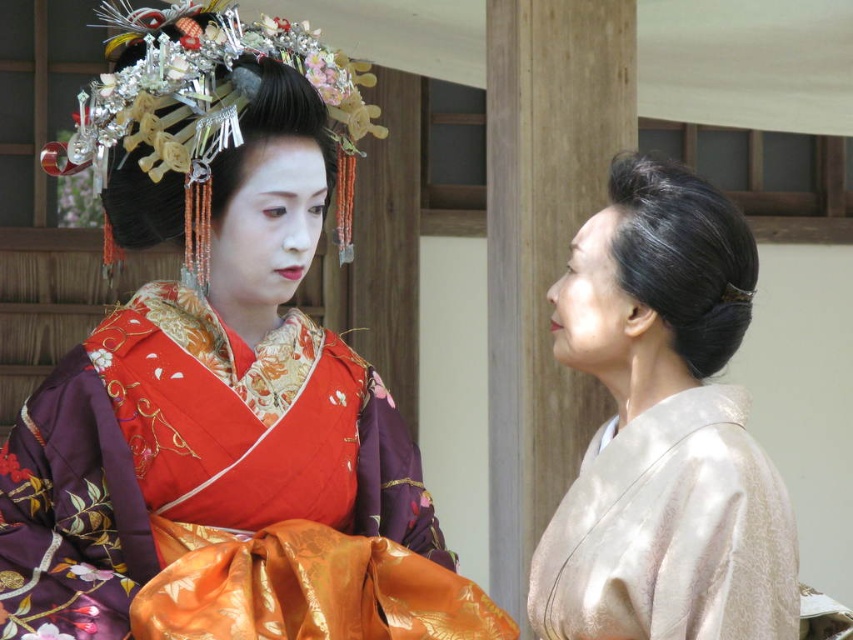
Is silky purple kimono at center smaller than satin beige kimono at right?

Incorrect, silky purple kimono at center is not smaller in size than satin beige kimono at right.

Is point (201, 602) farther from viewer compared to point (593, 262)?

No, (201, 602) is in front of (593, 262).

Identify the location of silky purple kimono at center. (221, 372).

Find the location of a particular element. silky purple kimono at center is located at coordinates click(x=221, y=372).